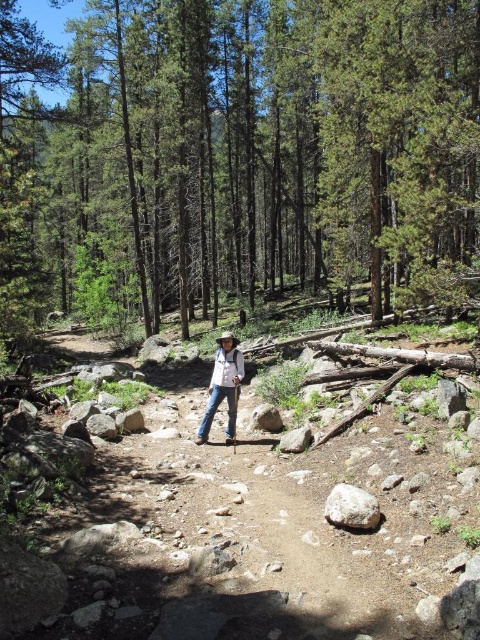
Is denim jeans at center to the left of gray rough rock at center from the viewer's perspective?

Yes, denim jeans at center is to the left of gray rough rock at center.

Is denim jeans at center wider than gray rough rock at center?

Yes.

Between point (227, 372) and point (359, 500), which one is positioned behind?

The point (227, 372) is behind.

In order to click on denim jeans at center in this screenshot , I will do `click(224, 385)`.

Looking at this image, can you confirm if green leafy tree at center is bigger than gray rough rock at center?

Yes, green leafy tree at center is bigger than gray rough rock at center.

Where is `green leafy tree at center`? green leafy tree at center is located at coordinates (240, 157).

Can you confirm if green leafy tree at center is positioned below denim jeans at center?

No, green leafy tree at center is not below denim jeans at center.

Who is more distant from viewer, [192,58] or [223,336]?

The point [192,58] is more distant.

Between point (177, 106) and point (200, 433), which one is positioned in front?

Positioned in front is point (200, 433).

I want to click on green leafy tree at center, so pyautogui.click(x=240, y=157).